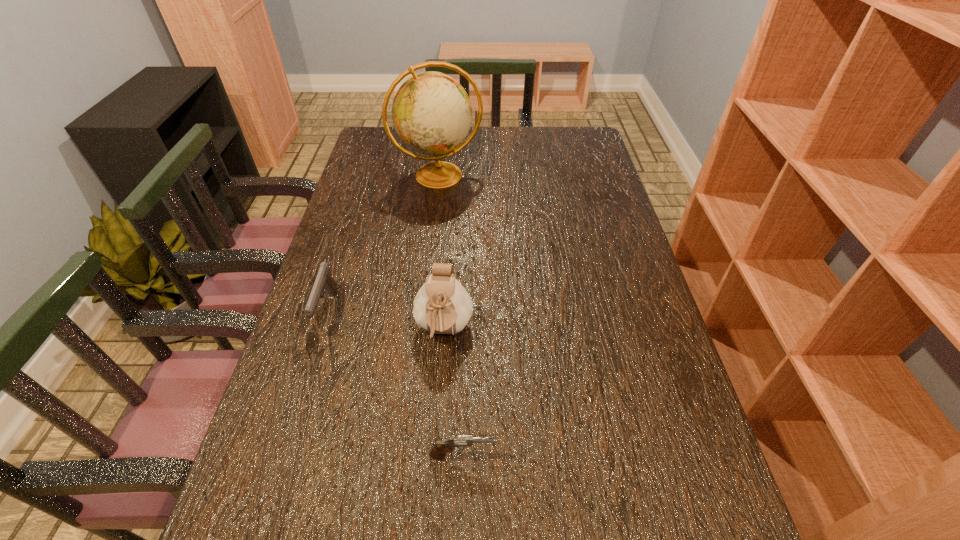
This screenshot has width=960, height=540. I want to click on the tallest object, so click(432, 114).

Find the location of `the farthest object`. the farthest object is located at coordinates (432, 114).

Identify the location of the second tallest object. The width and height of the screenshot is (960, 540). (442, 305).

You are a GUI agent. You are given a task and a screenshot of the screen. Output one action in this format:
    pyautogui.click(x=<x>, y=<y>)
    Task: Click on the farther pistol
    The width and height of the screenshot is (960, 540).
    Given the screenshot: What is the action you would take?
    pyautogui.click(x=324, y=282)

Where is `the left pistol`? the left pistol is located at coordinates (324, 282).

Locate an element on the screen. The width and height of the screenshot is (960, 540). the shorter pistol is located at coordinates (439, 450).

Identify the location of the shortest object. The height and width of the screenshot is (540, 960). [439, 450].

The image size is (960, 540). What are the coordinates of `free point located 0.180m on the front of the farthest object` in the screenshot? It's located at (432, 233).

In order to click on free space located on the front-facing side of the third shortest object in this screenshot , I will do `click(432, 500)`.

Where is `blank space located at the barrel of the taller pistol`? blank space located at the barrel of the taller pistol is located at coordinates (300, 399).